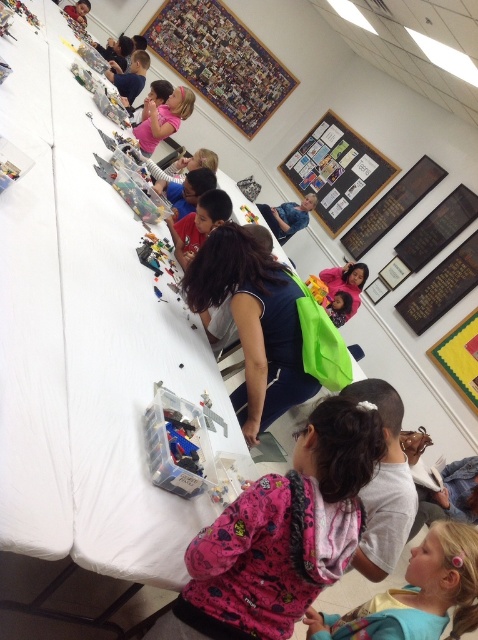
You are standing at the point marked as point (281,536) in the image. What object are you directly touching?

You are directly touching the pink fleece jacket at lower center.

Looking at this image, you are a student sitting at the long table and need to reach both the pink fabric at lower right and the black matte board at upper right. Which object is closer to your current position?

The pink fabric at lower right is closer to your current position because it is located below the black matte board at upper right, placing it nearer to the table level where you are sitting.